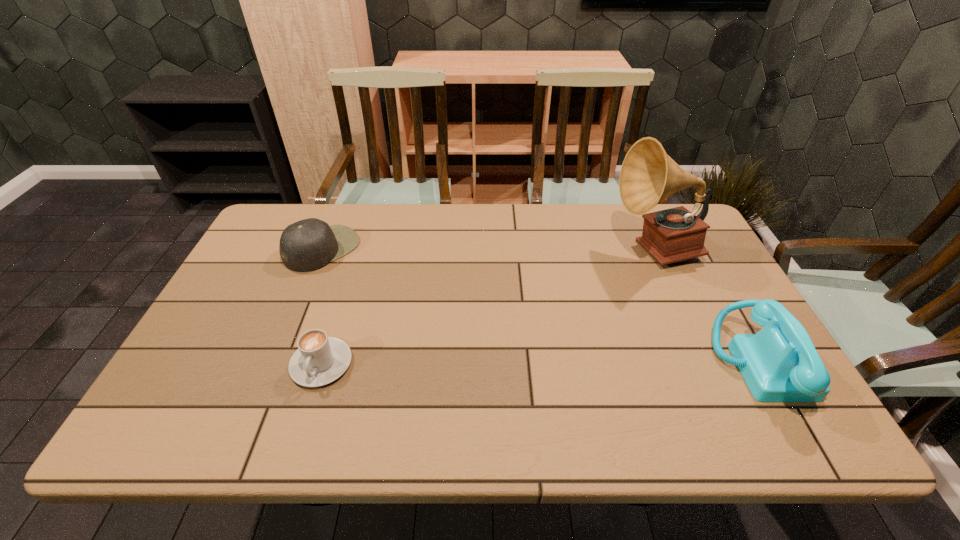
This screenshot has width=960, height=540. What are the coordinates of `free space on the desktop that is between the cappuccino and the second tallest object and is positioned on the horn of the tallest object` in the screenshot? It's located at (512, 363).

Find the location of a particular element. The height and width of the screenshot is (540, 960). vacant spot on the desktop that is between the cappuccino and the telephone and is positioned on the brim of the cap is located at coordinates (484, 363).